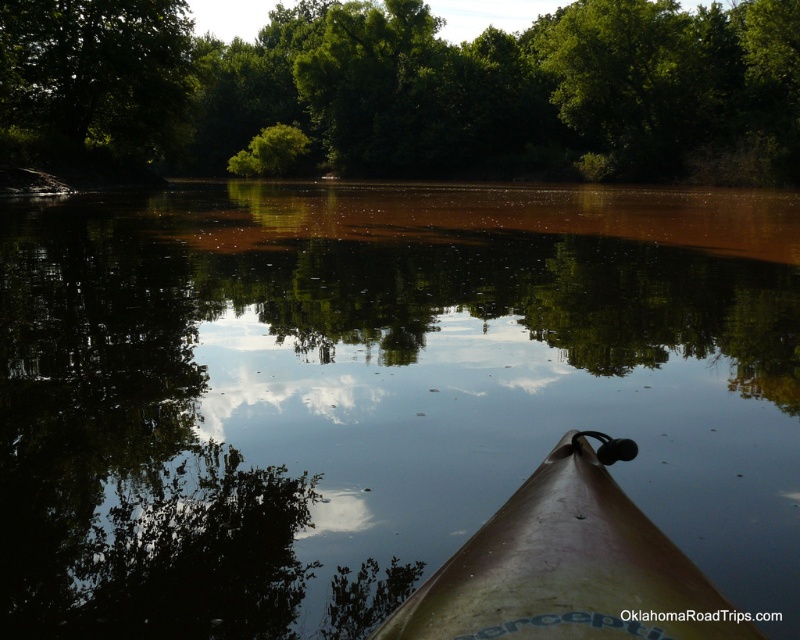
Can you confirm if brown matte kayak at center is shorter than green leafy tree at upper left?

Yes, brown matte kayak at center is shorter than green leafy tree at upper left.

Does brown matte kayak at center appear under green leafy tree at upper left?

Correct, brown matte kayak at center is located below green leafy tree at upper left.

The width and height of the screenshot is (800, 640). In order to click on brown matte kayak at center in this screenshot , I will do point(568,566).

Where is `brown matte kayak at center`? This screenshot has height=640, width=800. brown matte kayak at center is located at coordinates (568, 566).

From the picture: Is green leafy tree at upper center wider than green leafy tree at upper left?

Yes.

Who is positioned more to the right, green leafy tree at upper center or green leafy tree at upper left?

green leafy tree at upper center is more to the right.

Locate an element on the screen. This screenshot has height=640, width=800. green leafy tree at upper center is located at coordinates point(404,92).

Find the location of a particular element. green leafy tree at upper center is located at coordinates (404, 92).

Which is more to the right, green leafy tree at upper center or brown matte kayak at center?

brown matte kayak at center

At what (x,y) coordinates should I click in order to perform the action: click on green leafy tree at upper center. Please return your answer as a coordinate pair (x, y). The height and width of the screenshot is (640, 800). Looking at the image, I should click on (404, 92).

At what (x,y) coordinates should I click in order to perform the action: click on green leafy tree at upper center. Please return your answer as a coordinate pair (x, y). Looking at the image, I should click on (404, 92).

The image size is (800, 640). What are the coordinates of `green leafy tree at upper center` in the screenshot? It's located at click(404, 92).